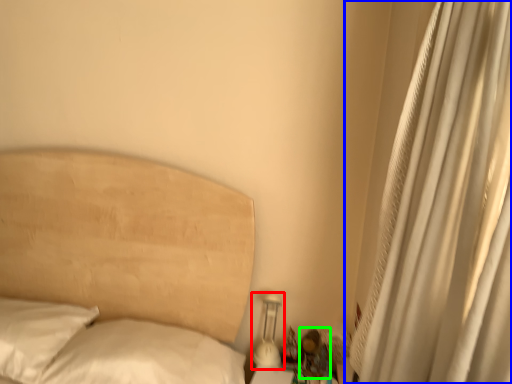
Question: Which object is the farthest from bedside lamp (highlighted by a red box)? Choose among these: curtain (highlighted by a blue box) or miniature (highlighted by a green box).

Choices:
 (A) curtain
 (B) miniature

Answer: (A)